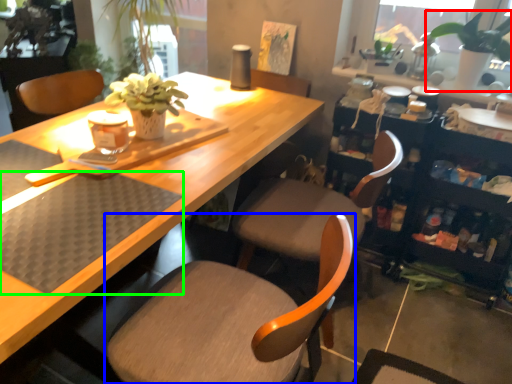
Question: Which is nearer to the houseplant (highlighted by a red box)? chair (highlighted by a blue box) or wide (highlighted by a green box).

Choices:
 (A) chair
 (B) wide

Answer: (A)